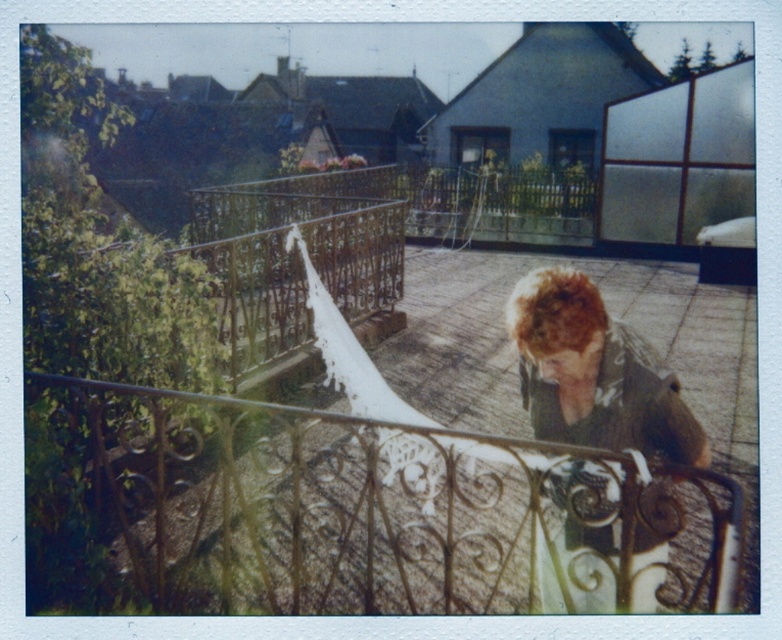
Question: Which point appears farthest from the camera in this image?

Choices:
 (A) (614, 465)
 (B) (271, 564)

Answer: (B)

Question: Among these objects, which one is nearest to the camera?

Choices:
 (A) wrought iron fence at center
 (B) shaggy brown hair at center

Answer: (A)

Question: Is wrought iron fence at center below shaggy brown hair at center?

Choices:
 (A) yes
 (B) no

Answer: (A)

Question: Is wrought iron fence at center smaller than shaggy brown hair at center?

Choices:
 (A) no
 (B) yes

Answer: (A)

Question: From the image, what is the correct spatial relationship of wrought iron fence at center in relation to shaggy brown hair at center?

Choices:
 (A) below
 (B) above

Answer: (A)